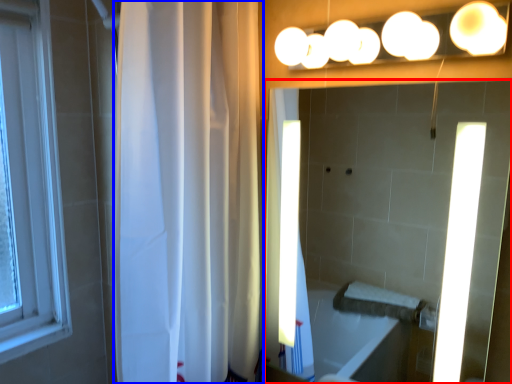
Question: Which of the following is the farthest to the observer, mirror (highlighted by a red box) or shower curtain (highlighted by a blue box)?

Choices:
 (A) mirror
 (B) shower curtain

Answer: (B)